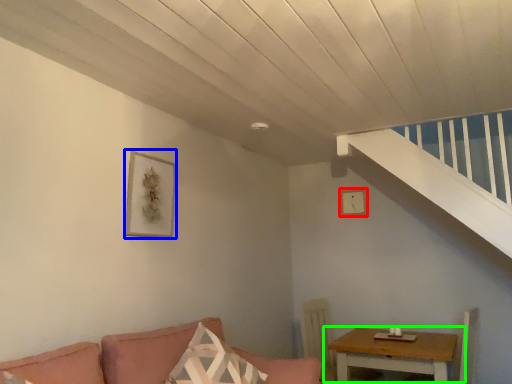
Question: Estimate the real-world distances between objects in this image. Which object is farther from picture frame (highlighted by a red box), picture frame (highlighted by a blue box) or table (highlighted by a green box)?

Choices:
 (A) picture frame
 (B) table

Answer: (A)